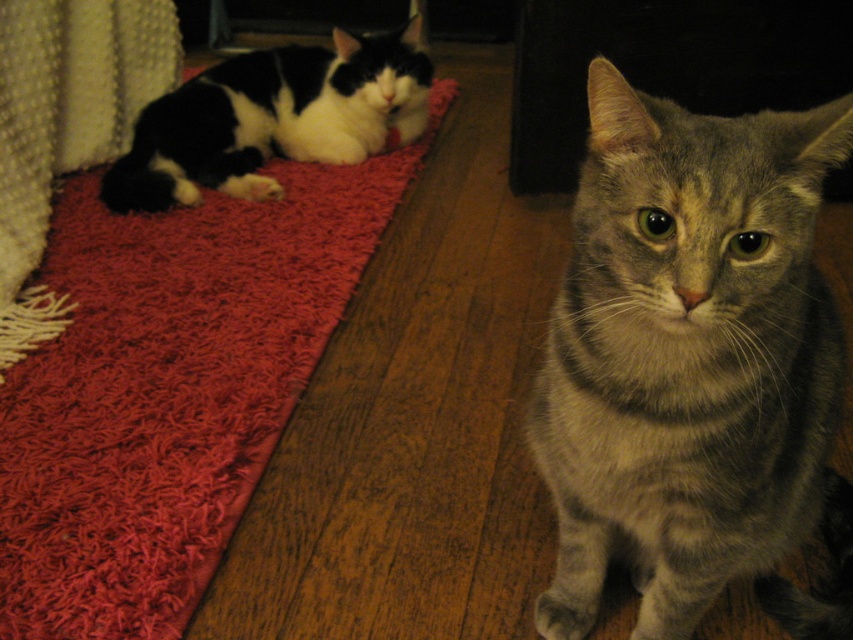
Image resolution: width=853 pixels, height=640 pixels. What are the coordinates of `red shaggy rug at upper left` in the screenshot? It's located at (169, 387).

Locate an element on the screen. Image resolution: width=853 pixels, height=640 pixels. red shaggy rug at upper left is located at coordinates (169, 387).

Is gray striped cat at center shorter than black and white fur cat at upper left?

No.

This screenshot has width=853, height=640. Describe the element at coordinates (693, 365) in the screenshot. I see `gray striped cat at center` at that location.

At what (x,y) coordinates should I click in order to perform the action: click on gray striped cat at center. Please return your answer as a coordinate pair (x, y). Looking at the image, I should click on (693, 365).

Does gray striped cat at center appear on the right side of red shaggy rug at upper left?

Indeed, gray striped cat at center is positioned on the right side of red shaggy rug at upper left.

Is point (756, 148) in front of point (94, 240)?

That is True.

Which is in front, point (689, 256) or point (119, 508)?

Positioned in front is point (689, 256).

Where is `gray striped cat at center`? Image resolution: width=853 pixels, height=640 pixels. gray striped cat at center is located at coordinates (693, 365).